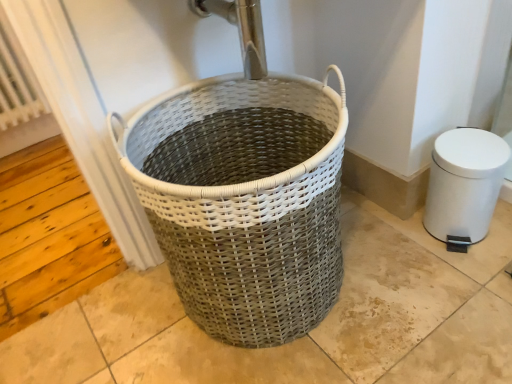
You are a GUI agent. You are given a task and a screenshot of the screen. Output one action in this format:
    pyautogui.click(x=<x>, y=<y>)
    Task: Click on the blank area to the left of white woven basket at center
    
    Given the screenshot: What is the action you would take?
    pyautogui.click(x=118, y=334)